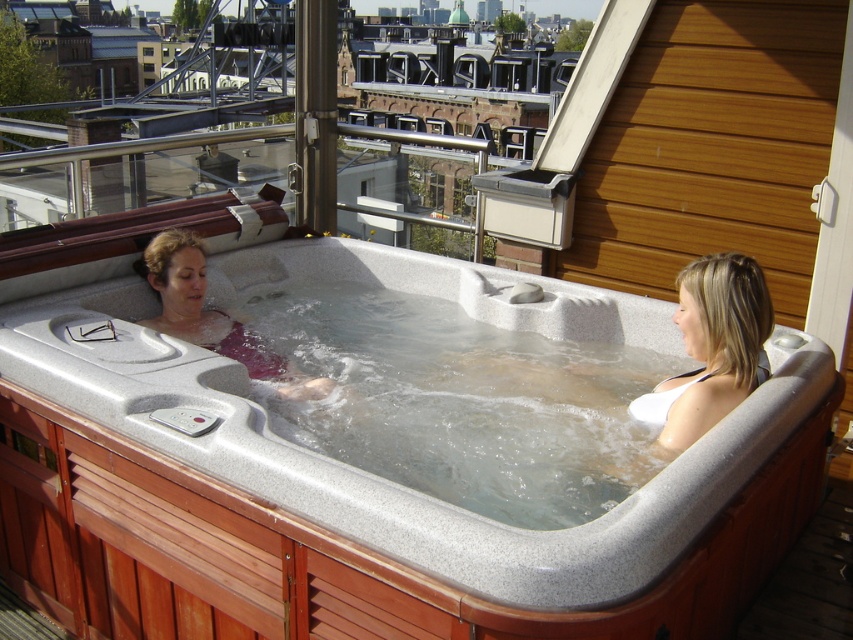
You are standing on the rooftop terrace and want to take a photo of the two points mentioned. Which point, point (9, 577) or point (213, 321), will appear larger in your camera view?

Point (9, 577) is closer to the camera than point (213, 321), so it will appear larger in the camera view.

You are a photographer taking a picture of the rooftop hot tub scene. You notice the white matte bikini at upper right and the matte pink fabric at center. Which object is positioned lower in the image?

The white matte bikini at upper right is below the matte pink fabric at center, so it is positioned lower in the image.